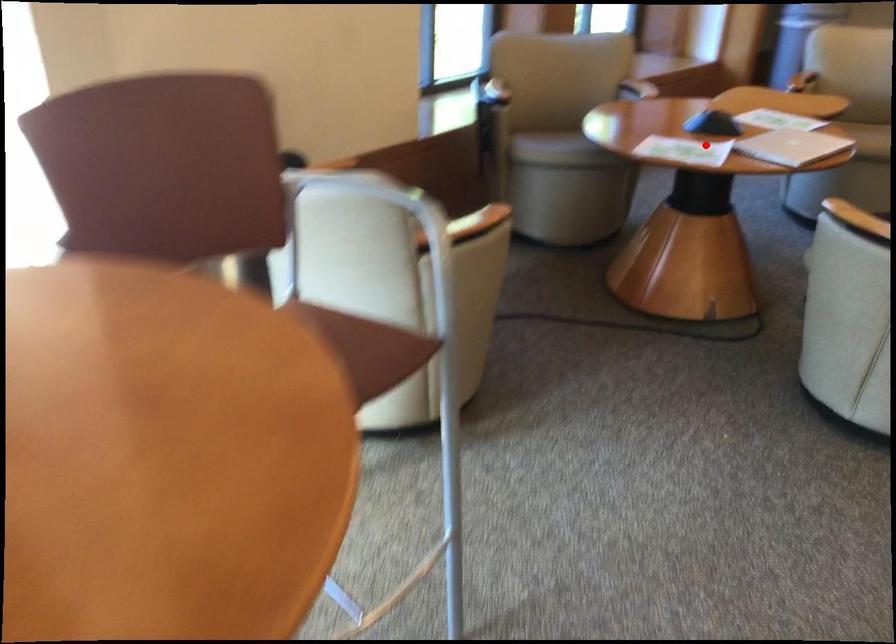
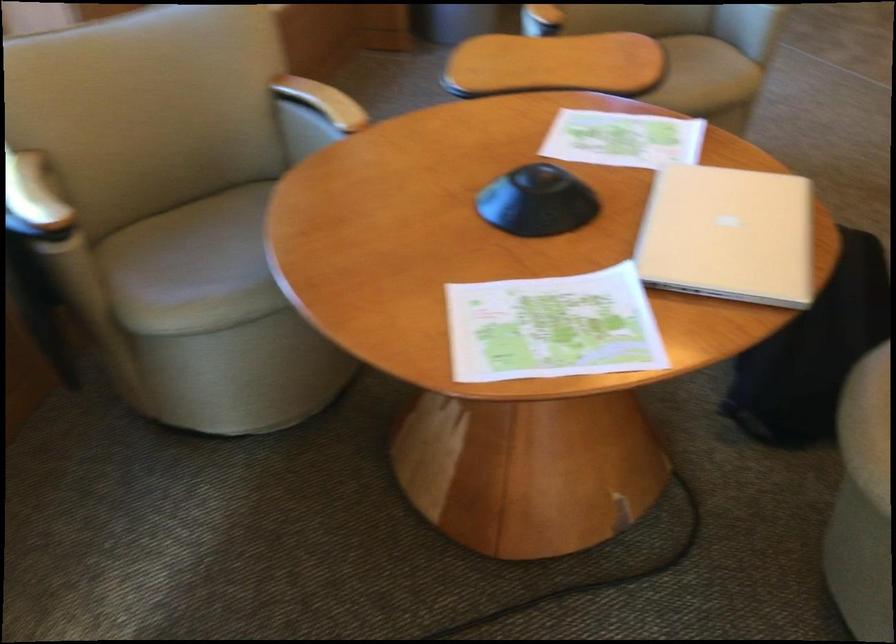
In the second image, find the point that corresponds to the highlighted location in the first image.

(552, 327)